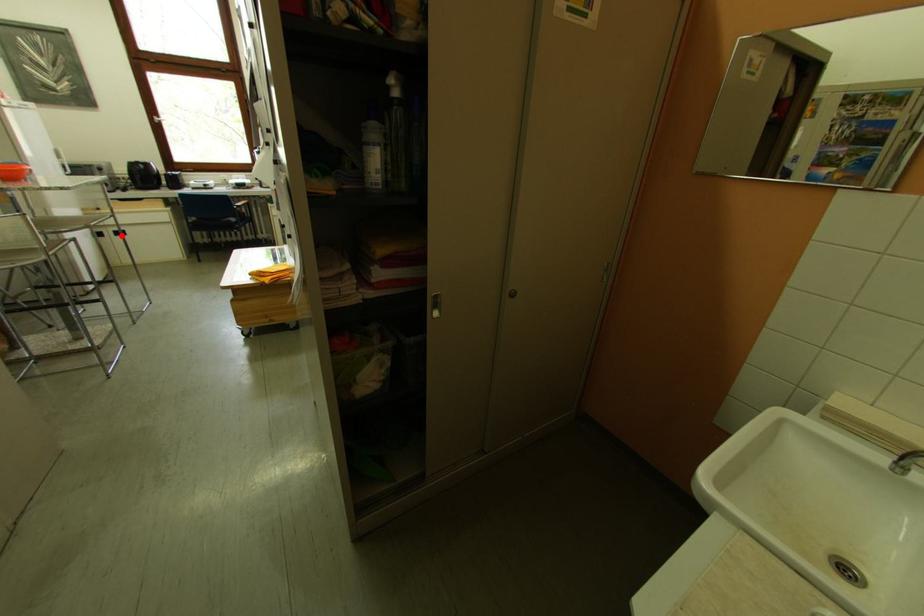
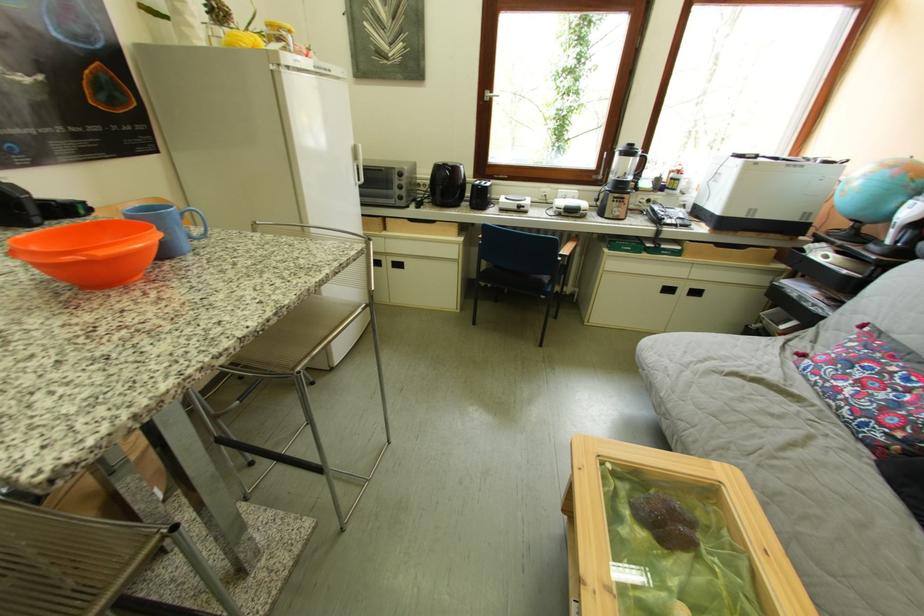
Question: I am providing you with two images of the same scene from different viewpoints. A red point is shown in image1. For the corresponding object point in image2, is it positioned nearer or farther from the camera?

Choices:
 (A) Nearer
 (B) Farther

Answer: (A)